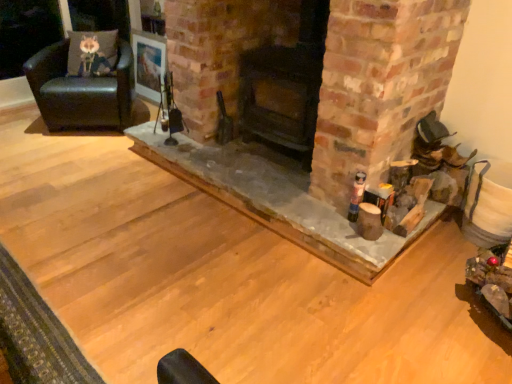
Image resolution: width=512 pixels, height=384 pixels. What do you see at coordinates (148, 64) in the screenshot? I see `wooden frame at upper center` at bounding box center [148, 64].

This screenshot has width=512, height=384. What do you see at coordinates (81, 91) in the screenshot?
I see `black leather chair at left` at bounding box center [81, 91].

Where is `smooth stone fireplace at center, which is the second fireplace in right-to-left order`? Image resolution: width=512 pixels, height=384 pixels. smooth stone fireplace at center, which is the second fireplace in right-to-left order is located at coordinates (308, 112).

At what (x,y) coordinates should I click in order to perform the action: click on wooden frame at upper center. Please return your answer as a coordinate pair (x, y). This screenshot has width=512, height=384. Looking at the image, I should click on (148, 64).

Between fuzzy fabric pillow at upper left and dark brown wood stove at center, positioned as the 1th fireplace in right-to-left order, which one appears on the left side from the viewer's perspective?

fuzzy fabric pillow at upper left.

From the image's perspective, who appears lower, fuzzy fabric pillow at upper left or dark brown wood stove at center, positioned as the 1th fireplace in right-to-left order?

From the image's view, dark brown wood stove at center, positioned as the 1th fireplace in right-to-left order, is below.

Is fuzzy fabric pillow at upper left behind dark brown wood stove at center, positioned as the 1th fireplace in right-to-left order?

Yes, the depth of fuzzy fabric pillow at upper left is greater than that of dark brown wood stove at center, positioned as the 1th fireplace in right-to-left order.

Is fuzzy fabric pillow at upper left bigger or smaller than dark brown wood stove at center, which appears as the second fireplace when viewed from the left?

Considering their sizes, fuzzy fabric pillow at upper left takes up less space than dark brown wood stove at center, which appears as the second fireplace when viewed from the left.

Which is behind, dark brown wood stove at center, positioned as the 1th fireplace in right-to-left order, or wooden frame at upper center?

wooden frame at upper center.

Considering the positions of objects dark brown wood stove at center, positioned as the 1th fireplace in right-to-left order, and wooden frame at upper center in the image provided, who is more to the left, dark brown wood stove at center, positioned as the 1th fireplace in right-to-left order, or wooden frame at upper center?

wooden frame at upper center.

There is a wooden frame at upper center. At what (x,y) coordinates should I click in order to perform the action: click on the 1st fireplace below it (from the image's perspective). Please return your answer as a coordinate pair (x, y). Image resolution: width=512 pixels, height=384 pixels. Looking at the image, I should click on (285, 87).

Considering the sizes of objects dark brown wood stove at center, positioned as the 1th fireplace in right-to-left order, and wooden frame at upper center in the image provided, who is thinner, dark brown wood stove at center, positioned as the 1th fireplace in right-to-left order, or wooden frame at upper center?

With smaller width is wooden frame at upper center.

From the image's perspective, which is below, dark brown wood stove at center, positioned as the 1th fireplace in right-to-left order, or smooth stone fireplace at center, which is the 1th fireplace in left-to-right order?

smooth stone fireplace at center, which is the 1th fireplace in left-to-right order.

Consider the image. How far apart are dark brown wood stove at center, which appears as the second fireplace when viewed from the left, and smooth stone fireplace at center, which is the second fireplace in right-to-left order?

dark brown wood stove at center, which appears as the second fireplace when viewed from the left, is 10.00 inches away from smooth stone fireplace at center, which is the second fireplace in right-to-left order.

Is dark brown wood stove at center, which appears as the second fireplace when viewed from the left, looking in the opposite direction of smooth stone fireplace at center, which is the second fireplace in right-to-left order?

No, dark brown wood stove at center, which appears as the second fireplace when viewed from the left, is not facing the opposite direction of smooth stone fireplace at center, which is the second fireplace in right-to-left order.

Is smooth stone fireplace at center, which is the 1th fireplace in left-to-right order, a part of dark brown wood stove at center, which appears as the second fireplace when viewed from the left?

No, smooth stone fireplace at center, which is the 1th fireplace in left-to-right order, is located outside of dark brown wood stove at center, which appears as the second fireplace when viewed from the left.

Can dark brown wood stove at center, which appears as the second fireplace when viewed from the left, be found inside smooth stone fireplace at center, which is the 1th fireplace in left-to-right order?

Definitely not — dark brown wood stove at center, which appears as the second fireplace when viewed from the left, is not inside smooth stone fireplace at center, which is the 1th fireplace in left-to-right order.

Considering their positions, is smooth stone fireplace at center, which is the second fireplace in right-to-left order, located in front of or behind dark brown wood stove at center, which appears as the second fireplace when viewed from the left?

In the image, smooth stone fireplace at center, which is the second fireplace in right-to-left order, appears in front of dark brown wood stove at center, which appears as the second fireplace when viewed from the left.

From the image's perspective, which is below, smooth stone fireplace at center, which is the second fireplace in right-to-left order, or dark brown wood stove at center, which appears as the second fireplace when viewed from the left?

From the image's view, smooth stone fireplace at center, which is the second fireplace in right-to-left order, is below.

Between smooth stone fireplace at center, which is the 1th fireplace in left-to-right order, and dark brown wood stove at center, positioned as the 1th fireplace in right-to-left order, which one has more height?

dark brown wood stove at center, positioned as the 1th fireplace in right-to-left order.

In terms of size, does black leather chair at left appear bigger or smaller than smooth stone fireplace at center, which is the 1th fireplace in left-to-right order?

black leather chair at left is smaller than smooth stone fireplace at center, which is the 1th fireplace in left-to-right order.

Is black leather chair at left not near smooth stone fireplace at center, which is the 1th fireplace in left-to-right order?

Indeed, black leather chair at left is not near smooth stone fireplace at center, which is the 1th fireplace in left-to-right order.

Which is farther from the camera, (52, 74) or (423, 109)?

Point (52, 74)

Between black leather chair at left and smooth stone fireplace at center, which is the second fireplace in right-to-left order, which one has smaller width?

black leather chair at left.

Consider the image. Does black leather chair at left appear on the right side of dark brown wood stove at center, which appears as the second fireplace when viewed from the left?

No, black leather chair at left is not to the right of dark brown wood stove at center, which appears as the second fireplace when viewed from the left.

Would you say black leather chair at left is outside dark brown wood stove at center, positioned as the 1th fireplace in right-to-left order?

Yes, black leather chair at left is not within dark brown wood stove at center, positioned as the 1th fireplace in right-to-left order.

Is black leather chair at left taller or shorter than dark brown wood stove at center, which appears as the second fireplace when viewed from the left?

Considering their sizes, black leather chair at left has less height than dark brown wood stove at center, which appears as the second fireplace when viewed from the left.

Is wooden frame at upper center bigger than smooth stone fireplace at center, which is the 1th fireplace in left-to-right order?

Actually, wooden frame at upper center might be smaller than smooth stone fireplace at center, which is the 1th fireplace in left-to-right order.

From the image's perspective, is wooden frame at upper center above smooth stone fireplace at center, which is the second fireplace in right-to-left order?

Yes, from the image's perspective, wooden frame at upper center is above smooth stone fireplace at center, which is the second fireplace in right-to-left order.

Considering the sizes of objects wooden frame at upper center and smooth stone fireplace at center, which is the 1th fireplace in left-to-right order, in the image provided, who is wider, wooden frame at upper center or smooth stone fireplace at center, which is the 1th fireplace in left-to-right order,?

smooth stone fireplace at center, which is the 1th fireplace in left-to-right order.

Would you say wooden frame at upper center is outside smooth stone fireplace at center, which is the 1th fireplace in left-to-right order?

Yes, wooden frame at upper center is not within smooth stone fireplace at center, which is the 1th fireplace in left-to-right order.

Starting from the fuzzy fabric pillow at upper left, which fireplace is the 1st one in front? Please provide its 2D coordinates.

[(285, 87)]

At what (x,y) coordinates should I click in order to perform the action: click on picture frame located behind the dark brown wood stove at center, positioned as the 1th fireplace in right-to-left order. Please return your answer as a coordinate pair (x, y). Looking at the image, I should click on (148, 64).

From the image, which object appears to be nearer to wooden frame at upper center, black leather chair at left or smooth stone fireplace at center, which is the second fireplace in right-to-left order?

black leather chair at left lies closer to wooden frame at upper center than the other object.

Looking at the image, which one is located further to fuzzy fabric pillow at upper left, wooden frame at upper center or dark brown wood stove at center, which appears as the second fireplace when viewed from the left?

dark brown wood stove at center, which appears as the second fireplace when viewed from the left.

From the image, which object appears to be nearer to dark brown wood stove at center, positioned as the 1th fireplace in right-to-left order, black leather chair at left or wooden frame at upper center?

black leather chair at left is closer to dark brown wood stove at center, positioned as the 1th fireplace in right-to-left order.

Looking at the image, which one is located closer to smooth stone fireplace at center, which is the 1th fireplace in left-to-right order, dark brown wood stove at center, positioned as the 1th fireplace in right-to-left order, or wooden frame at upper center?

Based on the image, dark brown wood stove at center, positioned as the 1th fireplace in right-to-left order, appears to be nearer to smooth stone fireplace at center, which is the 1th fireplace in left-to-right order.

Based on their spatial positions, is smooth stone fireplace at center, which is the second fireplace in right-to-left order, or dark brown wood stove at center, positioned as the 1th fireplace in right-to-left order, further from wooden frame at upper center?

smooth stone fireplace at center, which is the second fireplace in right-to-left order, is positioned further to the anchor wooden frame at upper center.

Consider the image. From the image, which object appears to be nearer to fuzzy fabric pillow at upper left, wooden frame at upper center or smooth stone fireplace at center, which is the 1th fireplace in left-to-right order?

wooden frame at upper center is positioned closer to the anchor fuzzy fabric pillow at upper left.

Estimate the real-world distances between objects in this image. Which object is closer to black leather chair at left, smooth stone fireplace at center, which is the 1th fireplace in left-to-right order, or fuzzy fabric pillow at upper left?

The object closer to black leather chair at left is fuzzy fabric pillow at upper left.

Considering their positions, is wooden frame at upper center positioned closer to dark brown wood stove at center, which appears as the second fireplace when viewed from the left, than black leather chair at left?

Based on the image, black leather chair at left appears to be nearer to dark brown wood stove at center, which appears as the second fireplace when viewed from the left.

This screenshot has width=512, height=384. What are the coordinates of `pillow located between smooth stone fireplace at center, which is the 1th fireplace in left-to-right order, and wooden frame at upper center in the depth direction` in the screenshot? It's located at (92, 53).

At what (x,y) coordinates should I click in order to perform the action: click on picture frame between fuzzy fabric pillow at upper left and dark brown wood stove at center, which appears as the second fireplace when viewed from the left, from left to right. Please return your answer as a coordinate pair (x, y). The image size is (512, 384). Looking at the image, I should click on (148, 64).

The width and height of the screenshot is (512, 384). Find the location of `pillow between black leather chair at left and wooden frame at upper center in the front-back direction`. pillow between black leather chair at left and wooden frame at upper center in the front-back direction is located at coordinates (92, 53).

Locate an element on the screen. The width and height of the screenshot is (512, 384). pillow between black leather chair at left and smooth stone fireplace at center, which is the 1th fireplace in left-to-right order is located at coordinates click(92, 53).